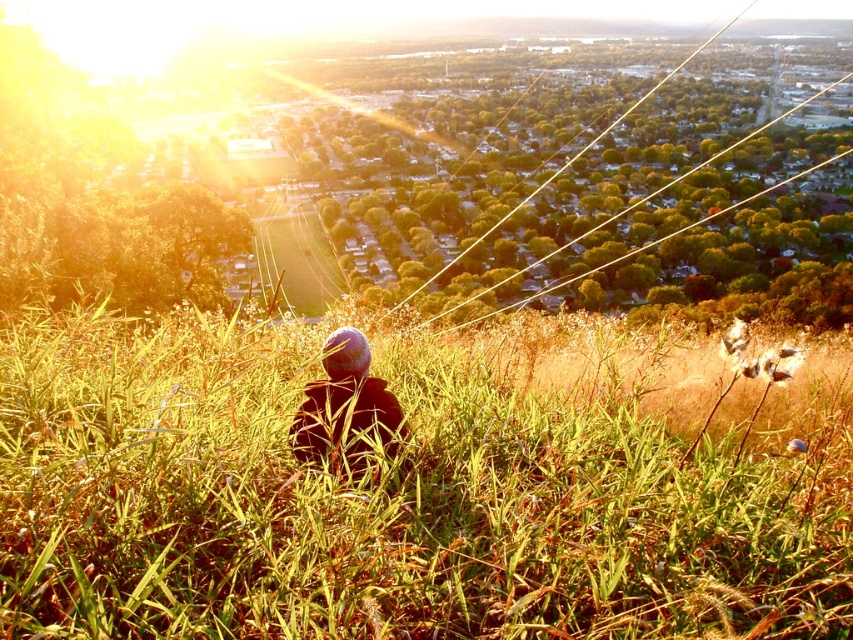
Can you confirm if green grassy at center is positioned to the right of dark fabric hat at center?

Indeed, green grassy at center is positioned on the right side of dark fabric hat at center.

The width and height of the screenshot is (853, 640). I want to click on green grassy at center, so click(368, 506).

Image resolution: width=853 pixels, height=640 pixels. I want to click on green grassy at center, so click(x=368, y=506).

Locate an element on the screen. The image size is (853, 640). green grassy at center is located at coordinates (368, 506).